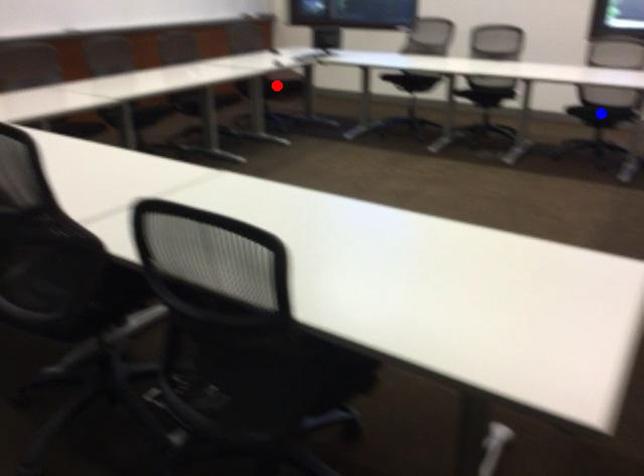
Question: Which of the two points in the image is closer to the camera?

Choices:
 (A) Blue point is closer.
 (B) Red point is closer.

Answer: (A)